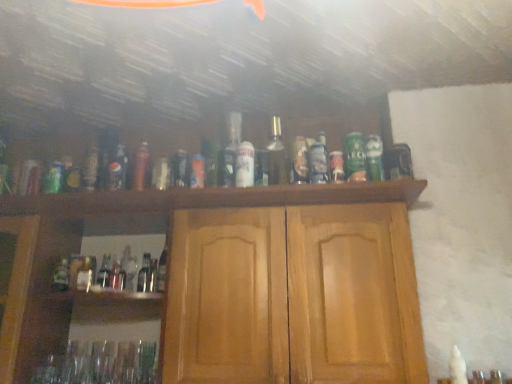
Question: Looking at the image, does matte glass bottle at center, the 8th bottle when ordered from left to right, seem bigger or smaller compared to green matte can at center, the first beer when ordered from right to left?

Choices:
 (A) big
 (B) small

Answer: (A)

Question: From the image's perspective, is matte glass bottle at center, the 8th bottle when ordered from left to right, above or below green matte can at center, the second beer positioned from the left?

Choices:
 (A) above
 (B) below

Answer: (A)

Question: Estimate the real-world distances between objects in this image. Which object is closer to the light brown wood cabinet at center?

Choices:
 (A) green matte can at center, the first beer when ordered from right to left
 (B) matte glass bottle at center, the fifth bottle in the right-to-left sequence
 (C) metallic gold bottle at center, arranged as the 5th bottle when viewed from the left
 (D) clear glass bottle at center, the fourth bottle from the left
 (E) metallic gold can at center, the 9th bottle positioned from the left

Answer: (E)

Question: Which is nearer to the green glass bottle at lower left, acting as the 1th bottle starting from the left?

Choices:
 (A) matte glass bottle at lower left, the 9th bottle when ordered from right to left
 (B) matte glass bottle at center, the fifth bottle in the right-to-left sequence
 (C) matte glass bottle at center, the 8th bottle when ordered from left to right
 (D) metallic gold bottle at center, placed as the 6th bottle when sorted from right to left
 (E) metallic silver can at center, marked as the first bottle in a right-to-left arrangement

Answer: (A)